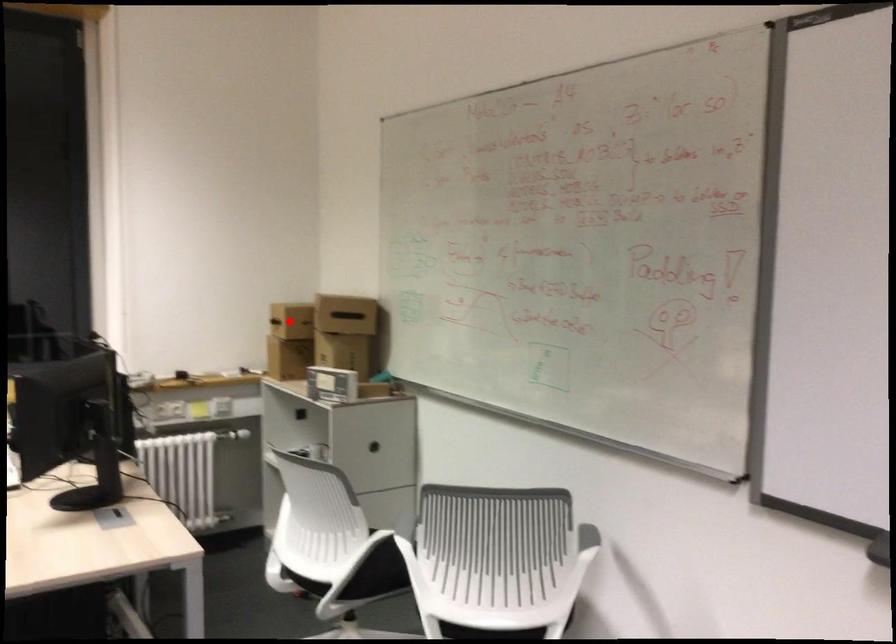
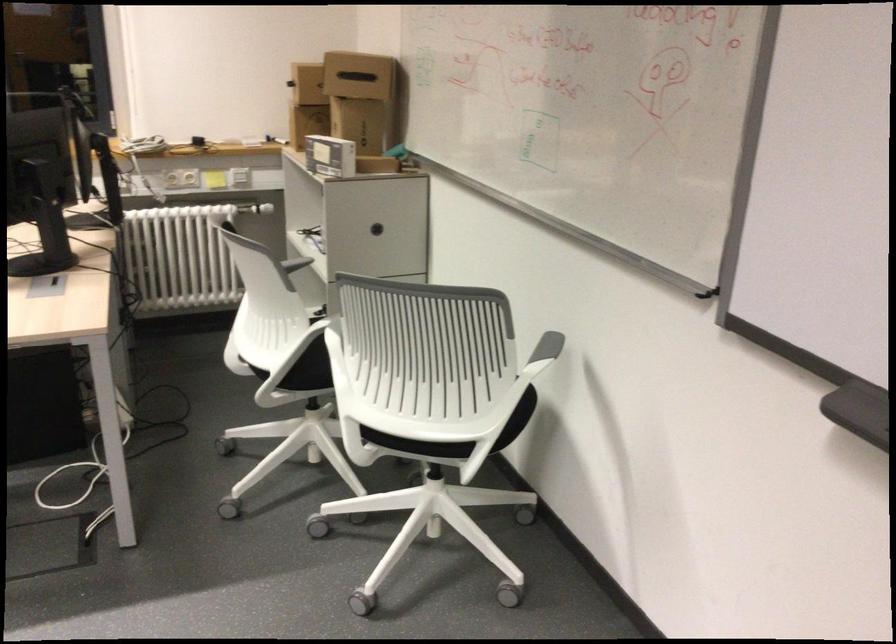
Question: I am providing you with two images of the same scene from different viewpoints. In image1, a red point is highlighted. Considering the same 3D point in image2, which of the following is correct?

Choices:
 (A) It is closer
 (B) It is farther

Answer: (A)